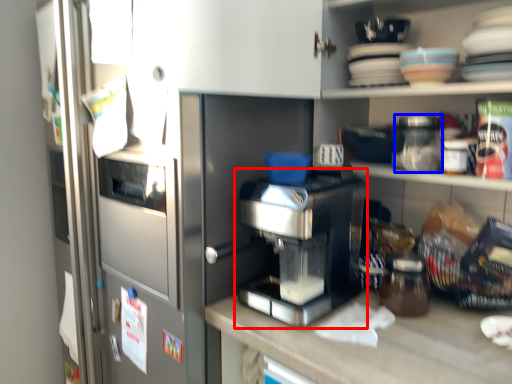
Question: Which object appears farthest to the camera in this image, home appliance (highlighted by a red box) or glass jar (highlighted by a blue box)?

Choices:
 (A) home appliance
 (B) glass jar

Answer: (B)